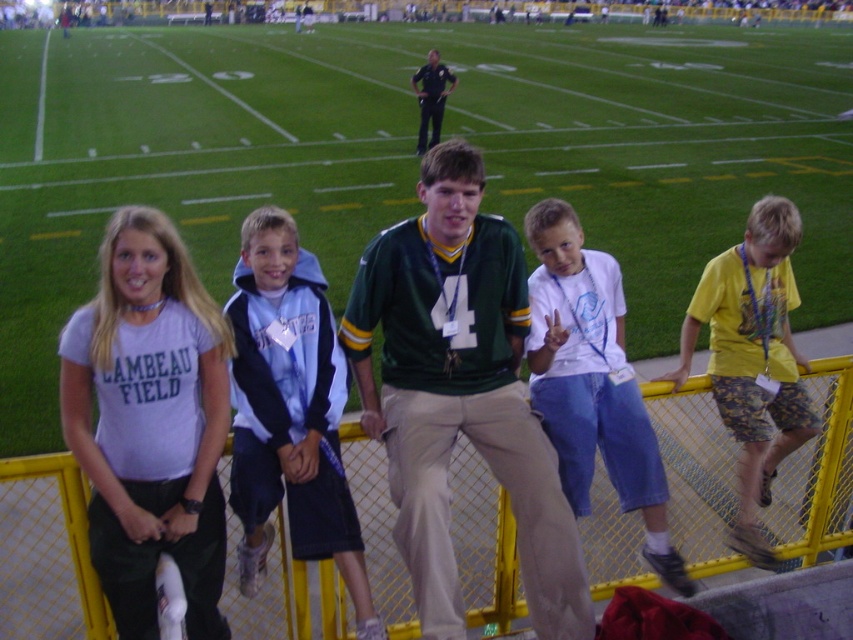
Question: Which object is farther from the camera taking this photo?

Choices:
 (A) blue fleece jacket at center
 (B) yellow metal fence at lower center

Answer: (B)

Question: Among these points, which one is farthest from the camera?

Choices:
 (A) (283, 388)
 (B) (601, 449)

Answer: (B)

Question: Can you confirm if blue fleece jacket at center is positioned below yellow cotton shirt at right?

Choices:
 (A) no
 (B) yes

Answer: (B)

Question: Can you confirm if green jersey at center is positioned above light purple t-shirt at center?

Choices:
 (A) yes
 (B) no

Answer: (A)

Question: Does green jersey at center have a lesser width compared to yellow cotton shirt at right?

Choices:
 (A) yes
 (B) no

Answer: (B)

Question: Among these objects, which one is nearest to the camera?

Choices:
 (A) green jersey at center
 (B) yellow metal fence at lower center
 (C) yellow cotton shirt at right
 (D) white cotton shirt at center

Answer: (A)